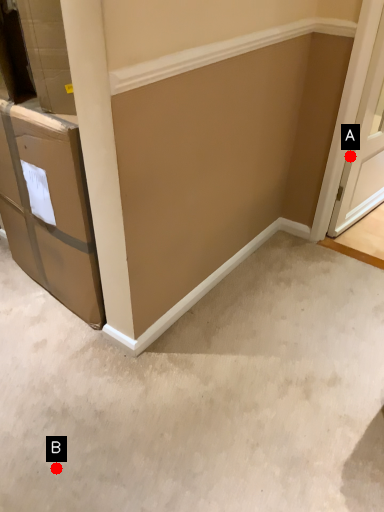
Question: Two points are circled on the image, labeled by A and B beside each circle. Which point is farther to the camera?

Choices:
 (A) A is further
 (B) B is further

Answer: (A)